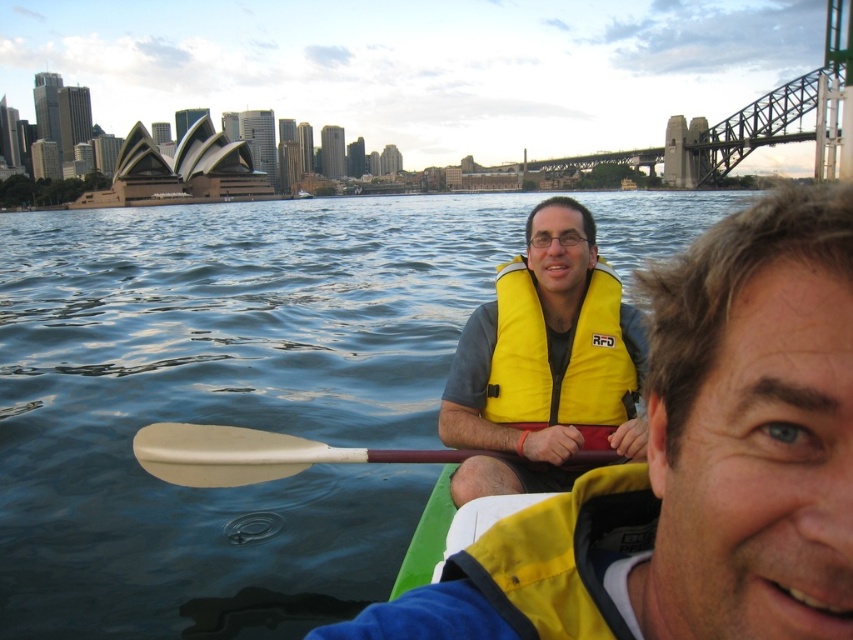
Question: Which of the following is the closest to the observer?

Choices:
 (A) pyautogui.click(x=202, y=508)
 (B) pyautogui.click(x=569, y=465)
 (C) pyautogui.click(x=538, y=321)

Answer: (B)

Question: Which point appears closest to the camera in this image?

Choices:
 (A) (514, 298)
 (B) (155, 609)
 (C) (521, 490)
 (D) (299, 460)

Answer: (D)

Question: Is dark blue water at center thinner than beige plastic paddle at center?

Choices:
 (A) no
 (B) yes

Answer: (A)

Question: Observing the image, what is the correct spatial positioning of yellow life vest at center in reference to yellow fabric life vest at center?

Choices:
 (A) above
 (B) below

Answer: (B)

Question: From the image, what is the correct spatial relationship of yellow life vest at center in relation to yellow fabric life vest at center?

Choices:
 (A) below
 (B) above

Answer: (A)

Question: Which point is farther from the camera taking this photo?

Choices:
 (A) (456, 445)
 (B) (426, 256)
 (C) (521, 371)
 (D) (271, 464)

Answer: (B)